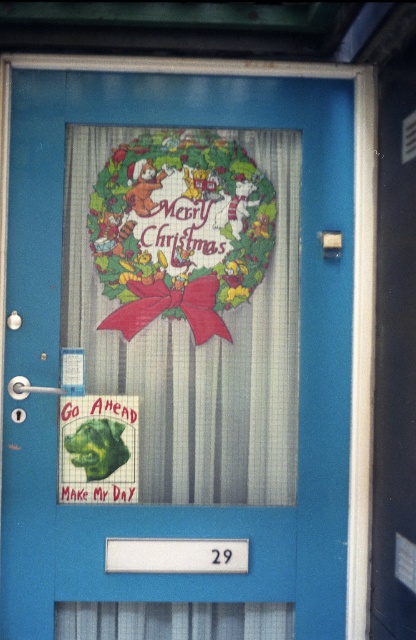
Question: Is decorative paper wreath at center behind green matte sign at lower left?

Choices:
 (A) yes
 (B) no

Answer: (A)

Question: Which object appears closest to the camera in this image?

Choices:
 (A) green matte sign at lower left
 (B) decorative paper wreath at center

Answer: (A)

Question: Where is decorative paper wreath at center located in relation to green matte sign at lower left in the image?

Choices:
 (A) above
 (B) below

Answer: (A)

Question: Does decorative paper wreath at center appear on the right side of green matte sign at lower left?

Choices:
 (A) yes
 (B) no

Answer: (A)